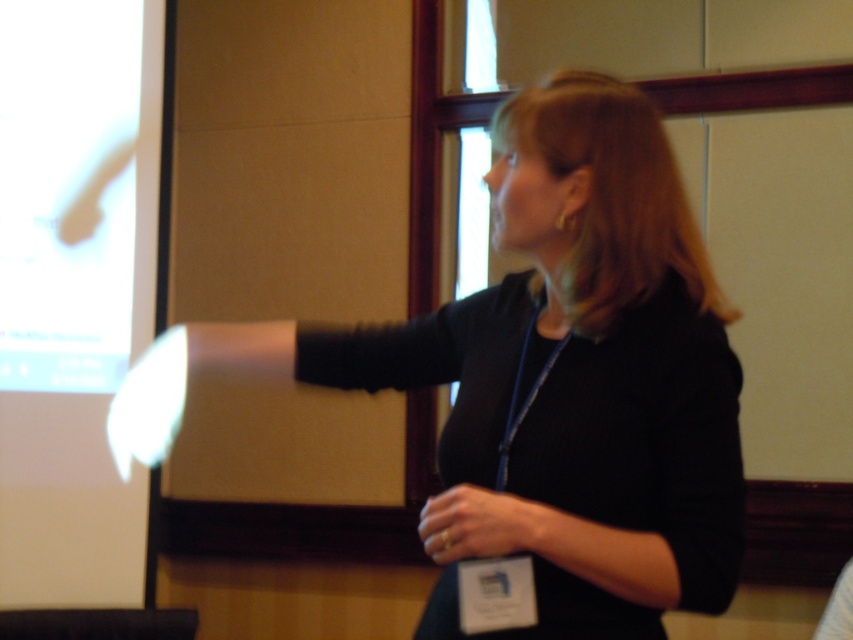
Question: Which of the following is the closest to the observer?

Choices:
 (A) white glossy projection screen at left
 (B) black matte shirt at center
 (C) gold ring at center

Answer: (B)

Question: Which point is farther to the camera?

Choices:
 (A) (42, 184)
 (B) (325, 380)
 (C) (459, 532)

Answer: (A)

Question: Is black matte shirt at center further to the viewer compared to gold ring at center?

Choices:
 (A) no
 (B) yes

Answer: (A)

Question: Can you confirm if black matte shirt at center is positioned above gold ring at center?

Choices:
 (A) no
 (B) yes

Answer: (B)

Question: Which is farther from the black matte shirt at center?

Choices:
 (A) gold ring at center
 (B) white glossy projection screen at left

Answer: (B)

Question: Is white glossy projection screen at left wider than gold ring at center?

Choices:
 (A) no
 (B) yes

Answer: (A)